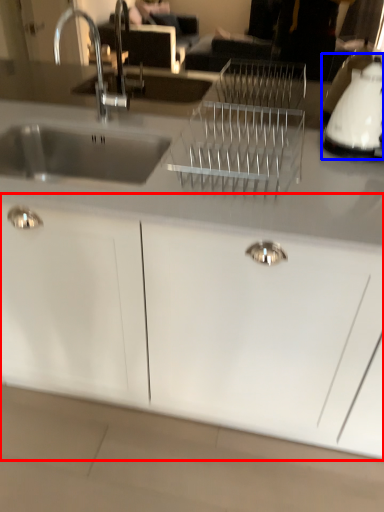
Question: Among these objects, which one is farthest to the camera, cabinetry (highlighted by a red box) or appliance (highlighted by a blue box)?

Choices:
 (A) cabinetry
 (B) appliance

Answer: (B)